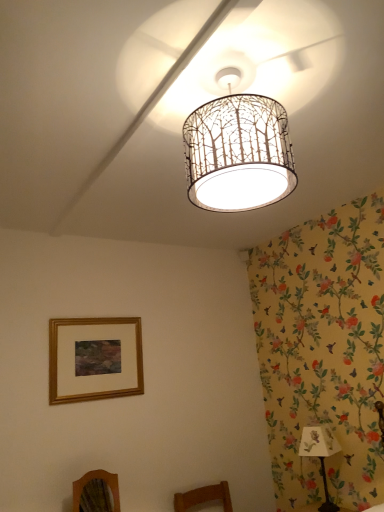
Question: Is wooden mirror at lower left surrounding white paper lampshade at center?

Choices:
 (A) yes
 (B) no

Answer: (B)

Question: From the image's perspective, is wooden mirror at lower left under white paper lampshade at center?

Choices:
 (A) no
 (B) yes

Answer: (B)

Question: Considering the relative sizes of wooden mirror at lower left and white paper lampshade at center in the image provided, is wooden mirror at lower left smaller than white paper lampshade at center?

Choices:
 (A) yes
 (B) no

Answer: (A)

Question: Are wooden mirror at lower left and white paper lampshade at center far apart?

Choices:
 (A) no
 (B) yes

Answer: (B)

Question: Does wooden mirror at lower left come in front of white paper lampshade at center?

Choices:
 (A) no
 (B) yes

Answer: (A)

Question: Based on their sizes in the image, would you say gold wooden picture frame at lower left is bigger or smaller than white paper lampshade at center?

Choices:
 (A) small
 (B) big

Answer: (A)

Question: From the image's perspective, relative to white paper lampshade at center, is gold wooden picture frame at lower left above or below?

Choices:
 (A) below
 (B) above

Answer: (A)

Question: Which is correct: gold wooden picture frame at lower left is inside white paper lampshade at center, or outside of it?

Choices:
 (A) outside
 (B) inside

Answer: (A)

Question: Looking at their shapes, would you say gold wooden picture frame at lower left is wider or thinner than white paper lampshade at center?

Choices:
 (A) thin
 (B) wide

Answer: (A)

Question: Is white paper shade at lower right wider or thinner than white paper lampshade at center?

Choices:
 (A) thin
 (B) wide

Answer: (A)

Question: Looking at the image, does white paper shade at lower right seem bigger or smaller compared to white paper lampshade at center?

Choices:
 (A) small
 (B) big

Answer: (A)

Question: In terms of height, does white paper shade at lower right look taller or shorter compared to white paper lampshade at center?

Choices:
 (A) short
 (B) tall

Answer: (B)

Question: From a real-world perspective, is white paper shade at lower right physically located above or below white paper lampshade at center?

Choices:
 (A) above
 (B) below

Answer: (B)

Question: Is gold wooden picture frame at lower left taller or shorter than white paper shade at lower right?

Choices:
 (A) tall
 (B) short

Answer: (A)

Question: Would you say gold wooden picture frame at lower left is inside or outside white paper shade at lower right?

Choices:
 (A) outside
 (B) inside

Answer: (A)